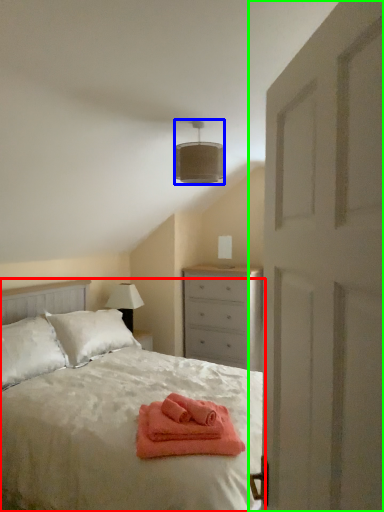
Question: Which object is the farthest from bed (highlighted by a red box)? Choose among these: lamp (highlighted by a blue box) or door (highlighted by a green box).

Choices:
 (A) lamp
 (B) door

Answer: (B)